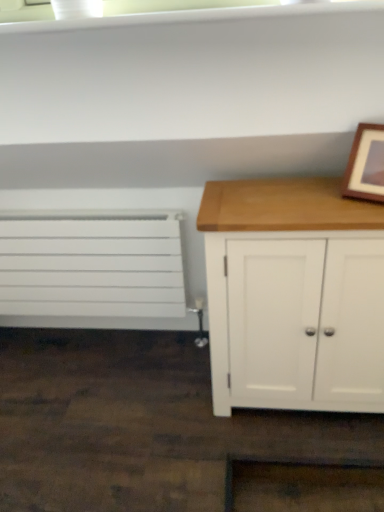
Question: Is white wood cabinet at right to the left or to the right of wooden picture frame at upper right in the image?

Choices:
 (A) right
 (B) left

Answer: (B)

Question: Looking at their shapes, would you say white wood cabinet at right is wider or thinner than wooden picture frame at upper right?

Choices:
 (A) thin
 (B) wide

Answer: (B)

Question: Which object is the closest to the white wood cabinet at right?

Choices:
 (A) white matte radiator at left
 (B) wooden picture frame at upper right

Answer: (B)

Question: Which object is the closest to the white wood cabinet at right?

Choices:
 (A) wooden picture frame at upper right
 (B) white matte radiator at left

Answer: (A)